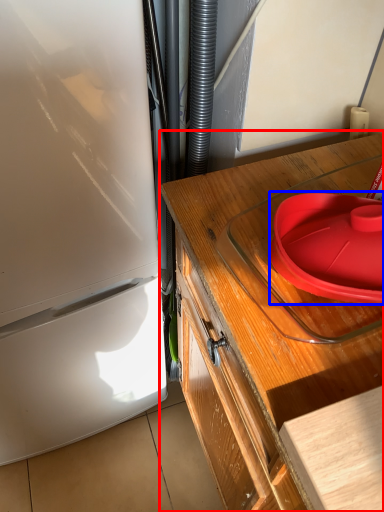
Question: Which object appears farthest to the camera in this image, countertop (highlighted by a red box) or plate (highlighted by a blue box)?

Choices:
 (A) countertop
 (B) plate

Answer: (B)